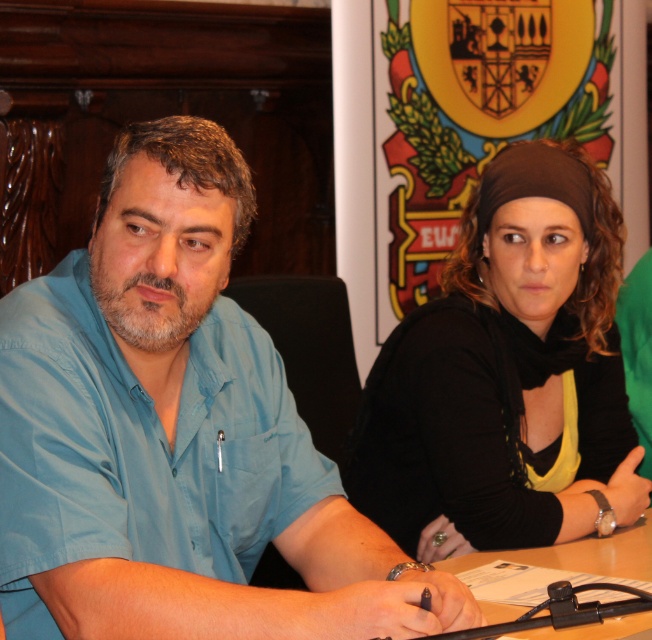
Is blue cotton shirt at left to the left of black matte headscarf at upper right from the viewer's perspective?

Yes, blue cotton shirt at left is to the left of black matte headscarf at upper right.

Which of these two, blue cotton shirt at left or black matte headscarf at upper right, stands shorter?

Standing shorter between the two is blue cotton shirt at left.

Does point (263, 433) lie behind point (539, 468)?

No, (263, 433) is closer to viewer.

Identify the location of blue cotton shirt at left. Image resolution: width=652 pixels, height=640 pixels. (175, 435).